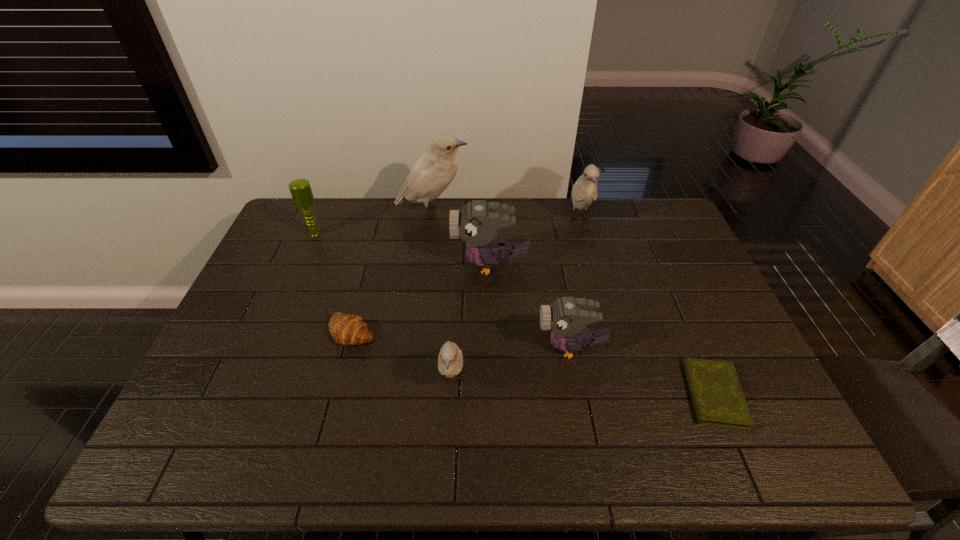
Where is `green diary`? The width and height of the screenshot is (960, 540). green diary is located at coordinates (718, 399).

Locate an element on the screen. the shortest object is located at coordinates (718, 399).

Identify the location of free region located at the beak of the biggest white bird. The height and width of the screenshot is (540, 960). (499, 211).

Locate an element on the screen. Image resolution: width=960 pixels, height=540 pixels. vacant area situated 0.200m at the beak of the second smallest white bird is located at coordinates (595, 279).

At what (x,y) coordinates should I click in order to perform the action: click on vacant space located 0.120m at the beak of the farther gray bird. Please return your answer as a coordinate pair (x, y). Image resolution: width=960 pixels, height=540 pixels. Looking at the image, I should click on (415, 265).

Find the location of a particular element. Image resolution: width=960 pixels, height=540 pixels. vacant space located 0.060m at the beak of the farther gray bird is located at coordinates (434, 265).

Find the location of a particular element. vacant space positioned at the beak of the farther gray bird is located at coordinates coord(383,265).

This screenshot has width=960, height=540. Identify the location of free region located 0.330m on the right of the microphone. (420, 234).

Where is `vacant space situated at the beak of the smallest white bird`? The height and width of the screenshot is (540, 960). vacant space situated at the beak of the smallest white bird is located at coordinates (449, 433).

You are a GUI agent. You are given a task and a screenshot of the screen. Output one action in this format:
    pyautogui.click(x=<x>, y=<y>)
    Task: Click on the free point located at the beak of the nearer gray bird
    The height and width of the screenshot is (540, 960).
    Given the screenshot: What is the action you would take?
    pyautogui.click(x=394, y=348)